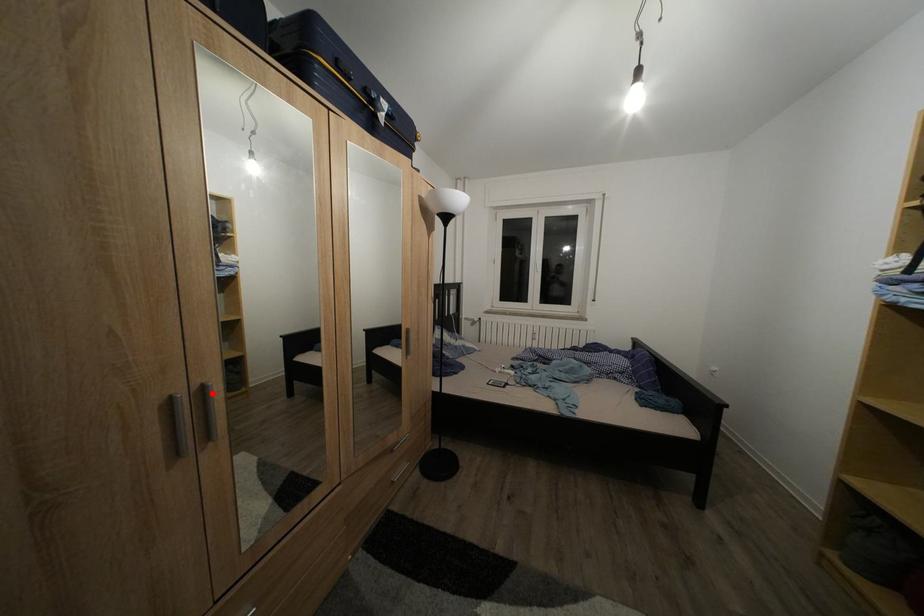
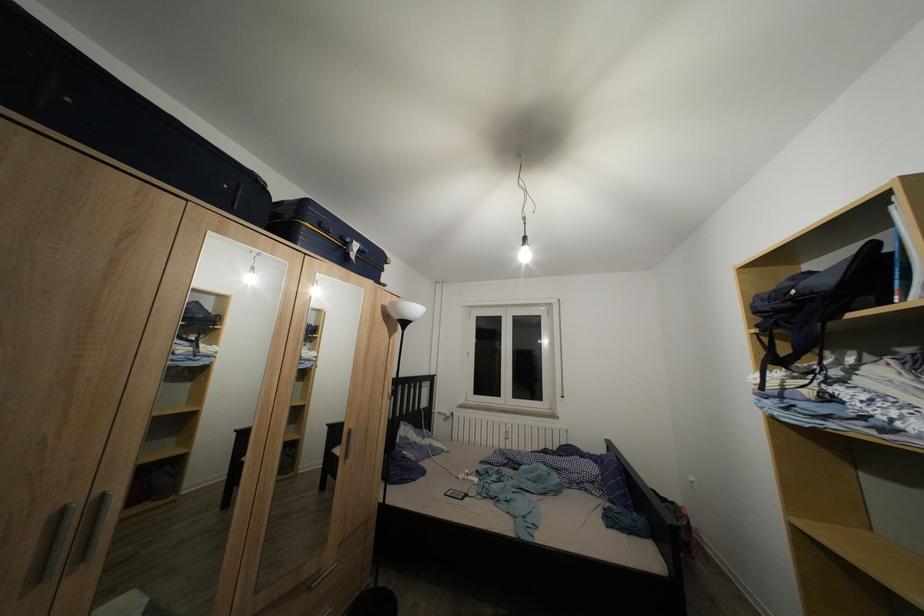
Where in the second image is the point corresponding to the highlighted location from the first image?

(111, 503)